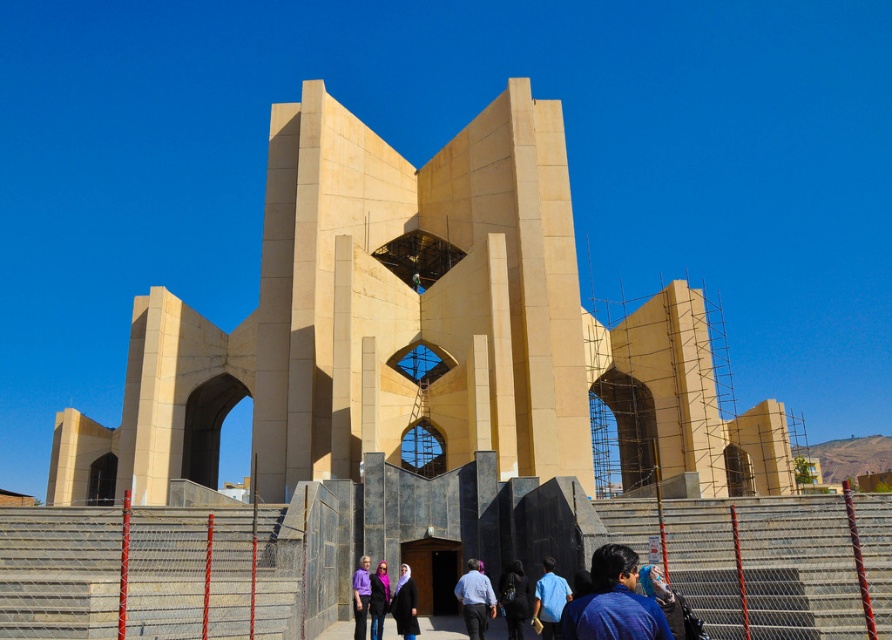
Question: Which of the following is the farthest from the observer?

Choices:
 (A) blue fabric shirt at lower right
 (B) beige stone monument at center

Answer: (B)

Question: Does matte black hijab at center have a greater width compared to purple matte shirt at center?

Choices:
 (A) yes
 (B) no

Answer: (B)

Question: Which object appears farthest from the camera in this image?

Choices:
 (A) beige stone monument at center
 (B) gray concrete stairs at lower left
 (C) matte purple scarf at center
 (D) blue fabric shirt at lower right

Answer: (A)

Question: Considering the relative positions of gray concrete stairs at lower left and light blue shirt at center in the image provided, where is gray concrete stairs at lower left located with respect to light blue shirt at center?

Choices:
 (A) below
 (B) above

Answer: (B)

Question: Which object is farther from the camera taking this photo?

Choices:
 (A) beige stone monument at center
 (B) dark blue fabric at center
 (C) blue fabric shirt at lower right
 (D) matte black hijab at center

Answer: (A)

Question: Where is light blue shirt at center located in relation to matte purple scarf at center in the image?

Choices:
 (A) above
 (B) below

Answer: (B)